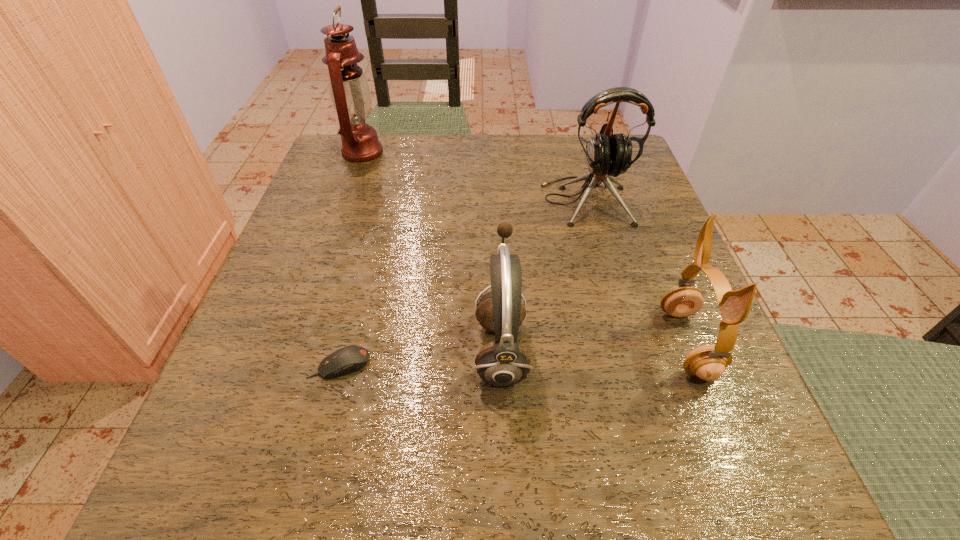
Find the location of a particular element. free space located 0.150m on the ear pads of the third object from right to left is located at coordinates (373, 349).

You are a GUI agent. You are given a task and a screenshot of the screen. Output one action in this format:
    pyautogui.click(x=<x>, y=<y>)
    Task: Click on the free region located on the right of the computer mouse
    The width and height of the screenshot is (960, 540).
    Given the screenshot: What is the action you would take?
    pyautogui.click(x=445, y=364)

Locate an element on the screen. Image resolution: width=960 pixels, height=540 pixels. oil lamp positioned at the far edge is located at coordinates (350, 94).

Where is `earphone that is at the far edge`? This screenshot has height=540, width=960. earphone that is at the far edge is located at coordinates (608, 154).

Where is `oil lamp located in the left edge section of the desktop`? The image size is (960, 540). oil lamp located in the left edge section of the desktop is located at coordinates (350, 94).

You are a GUI agent. You are given a task and a screenshot of the screen. Output one action in this format:
    pyautogui.click(x=<x>, y=<y>)
    Task: Click on the computer mouse present at the left edge
    This screenshot has width=960, height=540.
    Given the screenshot: What is the action you would take?
    pyautogui.click(x=348, y=359)

In order to click on object that is at the far left corner in this screenshot , I will do (x=350, y=94).

You are a GUI agent. You are given a task and a screenshot of the screen. Output one action in this format:
    pyautogui.click(x=<x>, y=<y>)
    Task: Click on the object that is at the far right corner
    This screenshot has width=960, height=540.
    Given the screenshot: What is the action you would take?
    pyautogui.click(x=608, y=154)

Image resolution: width=960 pixels, height=540 pixels. In the image, there is a desktop. Identify the location of blank space at the far edge. (507, 155).

The image size is (960, 540). Find the location of `free space at the near edge of the desktop`. free space at the near edge of the desktop is located at coordinates (635, 444).